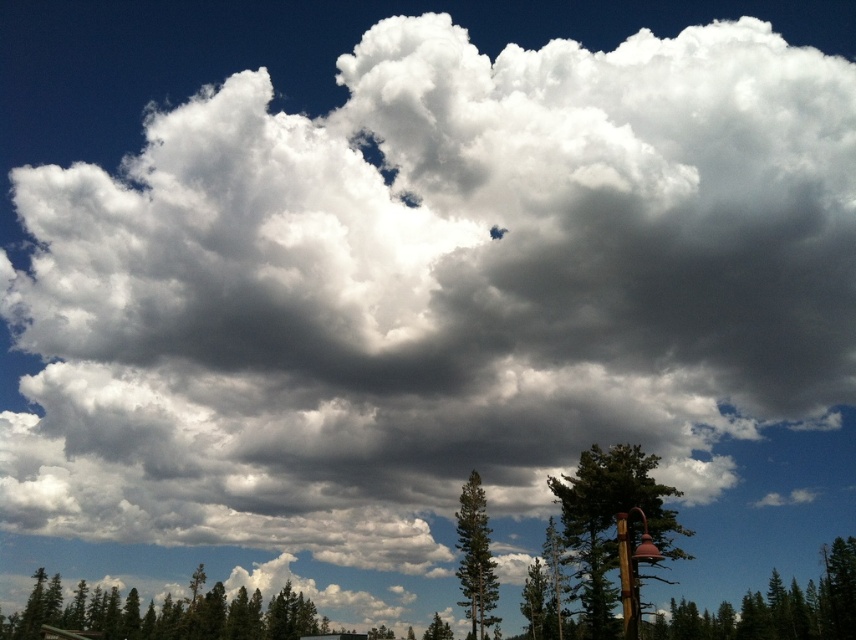
Is green textured tree at center below green textured tree at lower center?

No.

Is green textured tree at center wider than green textured tree at lower center?

In fact, green textured tree at center might be narrower than green textured tree at lower center.

Locate an element on the screen. Image resolution: width=856 pixels, height=640 pixels. green textured tree at center is located at coordinates (554, 580).

Does green textured tree at lower right appear on the right side of green textured tree at lower center?

Indeed, green textured tree at lower right is positioned on the right side of green textured tree at lower center.

Between green textured tree at lower right and green textured tree at lower center, which one appears on the right side from the viewer's perspective?

From the viewer's perspective, green textured tree at lower right appears more on the right side.

What are the coordinates of `green textured tree at lower right` in the screenshot? It's located at (776, 608).

Who is higher up, green matte tree at lower right or green textured tree at center?

green matte tree at lower right is higher up.

Can you confirm if green matte tree at lower right is wider than green textured tree at center?

Yes, green matte tree at lower right is wider than green textured tree at center.

Between point (575, 476) and point (551, 572), which one is positioned behind?

The point (551, 572) is more distant.

Locate an element on the screen. The height and width of the screenshot is (640, 856). green matte tree at lower right is located at coordinates (614, 531).